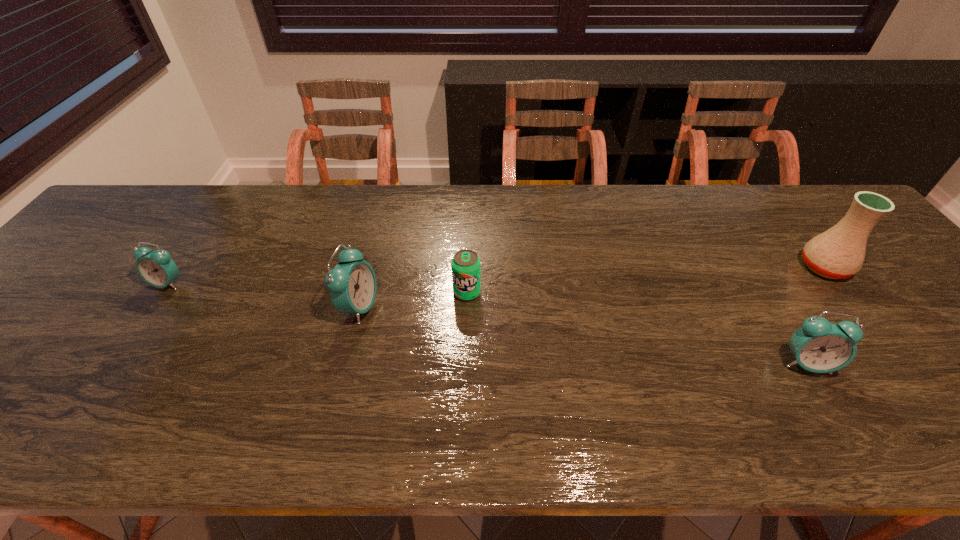
This screenshot has height=540, width=960. I want to click on vacant space located 0.190m on the back of the rightmost object, so click(779, 208).

Locate an element on the screen. The width and height of the screenshot is (960, 540). vacant space positioned 0.060m on the front-facing side of the third object from right to left is located at coordinates (466, 322).

Locate an element on the screen. This screenshot has width=960, height=540. object located in the near edge section of the desktop is located at coordinates (819, 346).

Where is `object situated at the right edge`? The image size is (960, 540). object situated at the right edge is located at coordinates (838, 253).

I want to click on vacant space at the far edge, so [x=712, y=192].

Locate an element on the screen. This screenshot has width=960, height=540. free space at the near edge of the desktop is located at coordinates (327, 399).

In the image, there is a desktop. Where is `vacant space at the left edge`? vacant space at the left edge is located at coordinates (75, 285).

In the image, there is a desktop. Where is `vacant space at the right edge`? This screenshot has width=960, height=540. vacant space at the right edge is located at coordinates (908, 336).

Where is `vacant space at the far left corner`? vacant space at the far left corner is located at coordinates (121, 202).

Locate an element on the screen. Image resolution: width=960 pixels, height=540 pixels. empty space between the second alarm clock from right to left and the leftmost object is located at coordinates (264, 295).